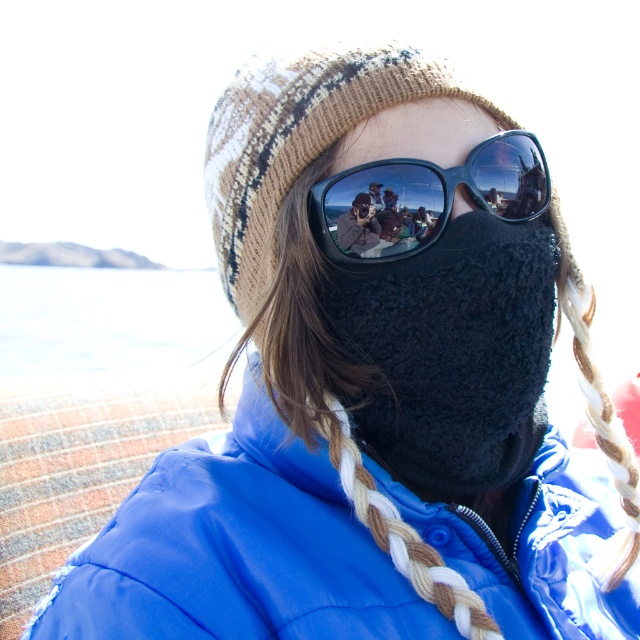
Who is lower down, blue puffy jacket at center or white water at left?

blue puffy jacket at center is lower down.

Does point (163, 548) come behind point (157, 310)?

No, (163, 548) is closer to viewer.

Does point (593, 602) lie behind point (147, 284)?

That is False.

This screenshot has height=640, width=640. I want to click on blue puffy jacket at center, so click(x=236, y=548).

Does black glossy sunglasses at center have a greater height compared to black fuzzy mask at center?

Indeed, black glossy sunglasses at center has a greater height compared to black fuzzy mask at center.

Is black glossy sunglasses at center shorter than black fuzzy mask at center?

No, black glossy sunglasses at center is not shorter than black fuzzy mask at center.

Is point (368, 188) farther from viewer compared to point (369, 208)?

That is False.

This screenshot has width=640, height=640. What are the coordinates of `black glossy sunglasses at center` in the screenshot? It's located at (424, 196).

Can you confirm if blue puffy jacket at center is positioned above black fuzzy mask at center?

Actually, blue puffy jacket at center is below black fuzzy mask at center.

Between point (609, 621) and point (356, 230), which one is positioned behind?

The point (609, 621) is behind.

Is point (404, 589) less distant than point (365, 230)?

That is True.

Locate an element on the screen. blue puffy jacket at center is located at coordinates (236, 548).